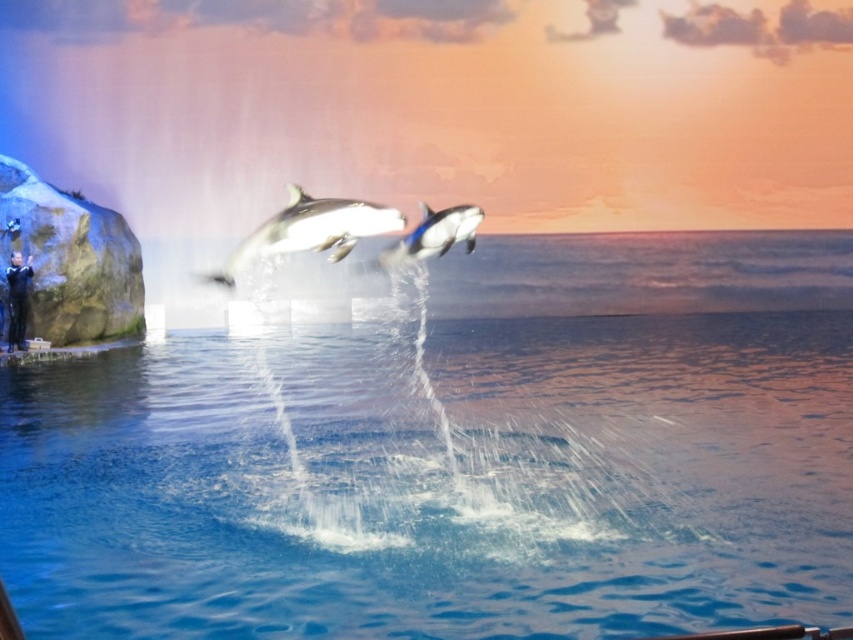
Question: From the image, what is the correct spatial relationship of black smooth dolphin at center in relation to black and white dolphin at center?

Choices:
 (A) above
 (B) below

Answer: (A)

Question: Does black smooth dolphin at center come behind black matte trainer at left?

Choices:
 (A) yes
 (B) no

Answer: (B)

Question: Which object is positioned farthest from the black and white dolphin at center?

Choices:
 (A) black smooth dolphin at center
 (B) clear blue water at center

Answer: (B)

Question: Which object is the closest to the black and white dolphin at center?

Choices:
 (A) black smooth dolphin at center
 (B) black matte trainer at left
 (C) clear blue water at center

Answer: (A)

Question: Which point is closer to the camera?

Choices:
 (A) black and white dolphin at center
 (B) black smooth dolphin at center
 (C) black matte trainer at left
 (D) clear blue water at center

Answer: (D)

Question: Can you confirm if black smooth dolphin at center is positioned to the left of black and white dolphin at center?

Choices:
 (A) yes
 (B) no

Answer: (A)